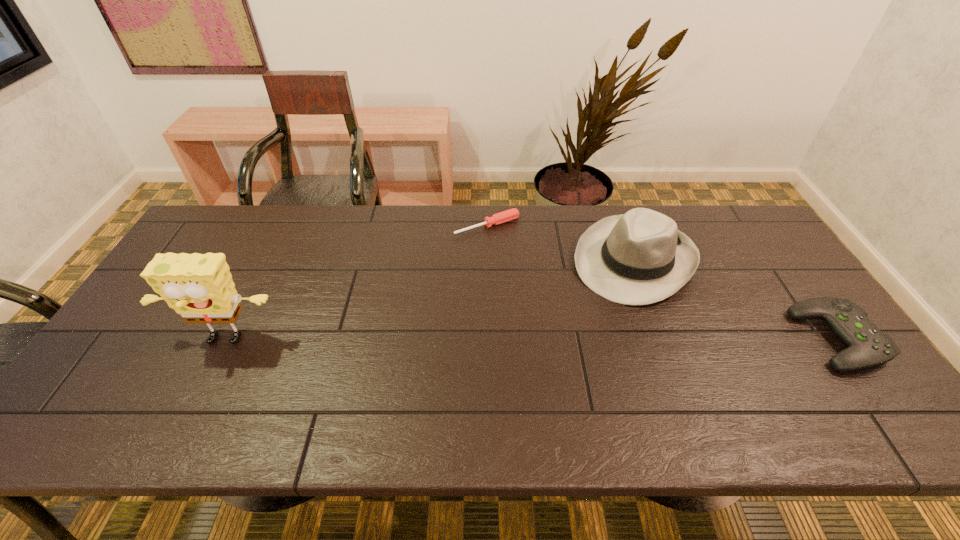
Where is `free spot between the sponge and the third object from left to right`? This screenshot has height=540, width=960. free spot between the sponge and the third object from left to right is located at coordinates (429, 301).

Identify the location of free space between the shortest object and the third shortest object. The image size is (960, 540). (561, 243).

Image resolution: width=960 pixels, height=540 pixels. In order to click on vacant area between the sponge and the third object from left to right in this screenshot , I will do `click(429, 301)`.

Identify the location of free point between the second object from right to left and the third tallest object. The width and height of the screenshot is (960, 540). (736, 300).

Where is `object that stands as the second closest to the second object from right to left`? This screenshot has height=540, width=960. object that stands as the second closest to the second object from right to left is located at coordinates (868, 346).

You are a GUI agent. You are given a task and a screenshot of the screen. Output one action in this format:
    pyautogui.click(x=<x>, y=<y>)
    Task: Click on the object that is the nearest to the shortest object
    This screenshot has width=960, height=540.
    Given the screenshot: What is the action you would take?
    pyautogui.click(x=638, y=258)